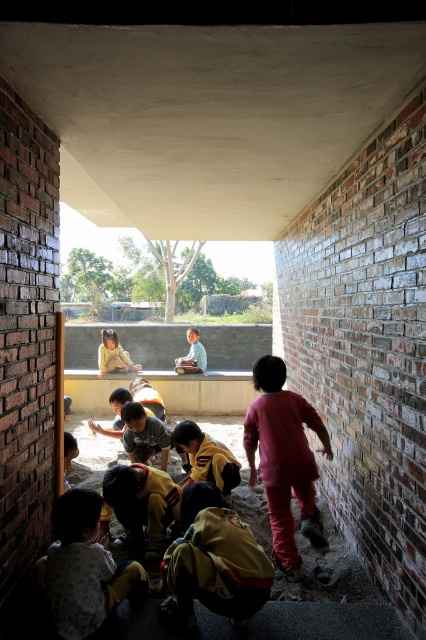
Identify the location of yellow fabric pants at lower center. (141, 502).

Consider the image. Is yellow fabric pants at lower center below light blue shirt at center?

Yes, yellow fabric pants at lower center is below light blue shirt at center.

Is point (126, 500) more distant than point (195, 330)?

No, (126, 500) is in front of (195, 330).

This screenshot has width=426, height=640. What are the coordinates of `yellow fabric pants at lower center` in the screenshot? It's located at (141, 502).

Between point (109, 518) and point (224, 465), which one is positioned behind?

The point (224, 465) is behind.

Does yellow fabric pants at lower center come in front of yellow fabric at center?

Yes, yellow fabric pants at lower center is in front of yellow fabric at center.

Who is more forward, (129, 492) or (218, 461)?

Point (129, 492)

The height and width of the screenshot is (640, 426). I want to click on yellow fabric pants at lower center, so click(141, 502).

Does yellow fabric pants at lower center have a smaller size compared to matte yellow shirt at center?

Indeed, yellow fabric pants at lower center has a smaller size compared to matte yellow shirt at center.

Can you confirm if yellow fabric pants at lower center is positioned below matte yellow shirt at center?

Indeed, yellow fabric pants at lower center is positioned under matte yellow shirt at center.

Is point (129, 532) farther from camera compared to point (131, 365)?

That is False.

In order to click on yellow fabric pants at lower center in this screenshot , I will do `click(141, 502)`.